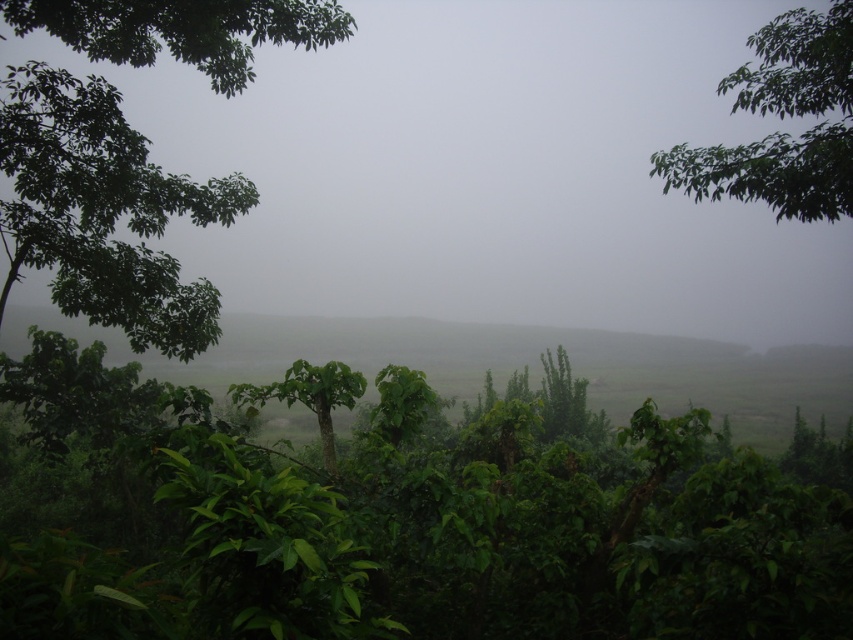
Between green leafy vegetation at center and foggy mist at center, which one appears on the right side from the viewer's perspective?

Positioned to the right is green leafy vegetation at center.

Is the position of green leafy vegetation at center less distant than that of foggy mist at center?

That is True.

This screenshot has height=640, width=853. What do you see at coordinates (404, 513) in the screenshot?
I see `green leafy vegetation at center` at bounding box center [404, 513].

Image resolution: width=853 pixels, height=640 pixels. I want to click on green leafy vegetation at center, so click(x=404, y=513).

How distant is foggy mist at center from green leafy tree at left?

foggy mist at center is 30.68 meters from green leafy tree at left.

Which is in front, point (827, 321) or point (26, 211)?

Positioned in front is point (26, 211).

Identify the location of foggy mist at center. This screenshot has width=853, height=640. (491, 172).

Measure the distance between point (57, 243) and camera.

Point (57, 243) is 10.49 meters away from camera.

Is point (36, 74) positioned before point (792, 112)?

Yes, point (36, 74) is in front of point (792, 112).

Does point (16, 160) come in front of point (827, 145)?

No, it is not.

I want to click on green leafy tree at left, so click(102, 211).